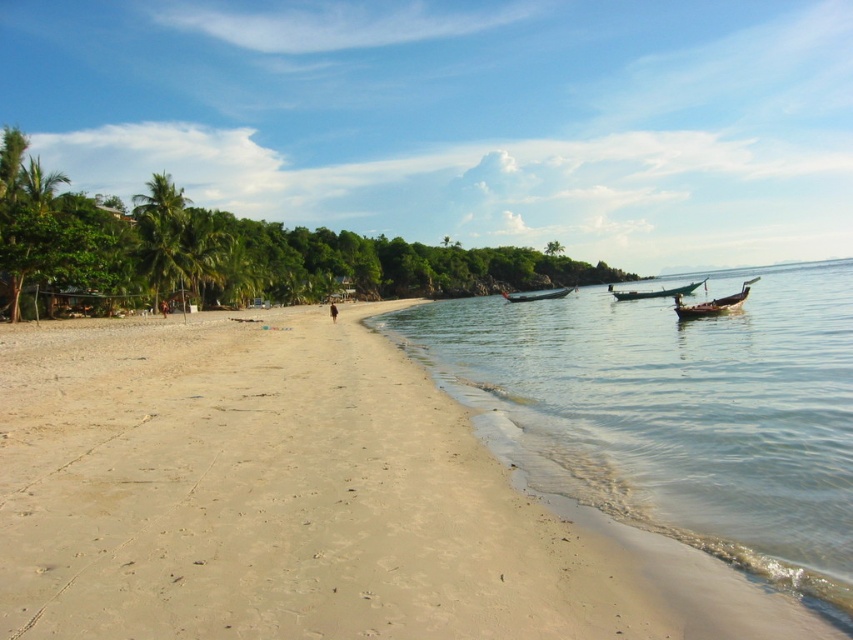
From the picture: Is green leafy palm tree at left thinner than green wooden boat at right?

No.

Who is higher up, green leafy palm tree at left or green wooden boat at right?

green leafy palm tree at left is above.

Is point (157, 273) behind point (663, 292)?

Yes, it is behind point (663, 292).

This screenshot has width=853, height=640. I want to click on green leafy palm tree at left, so click(160, 234).

Does point (161, 253) come in front of point (677, 305)?

No.

Consider the image. Is green leafy palm tree at left positioned behind wooden longboat at right?

Yes, green leafy palm tree at left is further from the viewer.

Does point (158, 243) lie behind point (729, 310)?

Yes, point (158, 243) is behind point (729, 310).

Identify the location of green leafy palm tree at left. The height and width of the screenshot is (640, 853). (160, 234).

Is point (650, 468) closer to camera compared to point (151, 275)?

Yes, it is.

Who is higher up, clear water at lower right or green leafy palm tree at left?

green leafy palm tree at left is higher up.

Between point (467, 360) and point (135, 216), which one is positioned behind?

Positioned behind is point (135, 216).

Where is `clear water at lower right`? This screenshot has height=640, width=853. clear water at lower right is located at coordinates (676, 412).